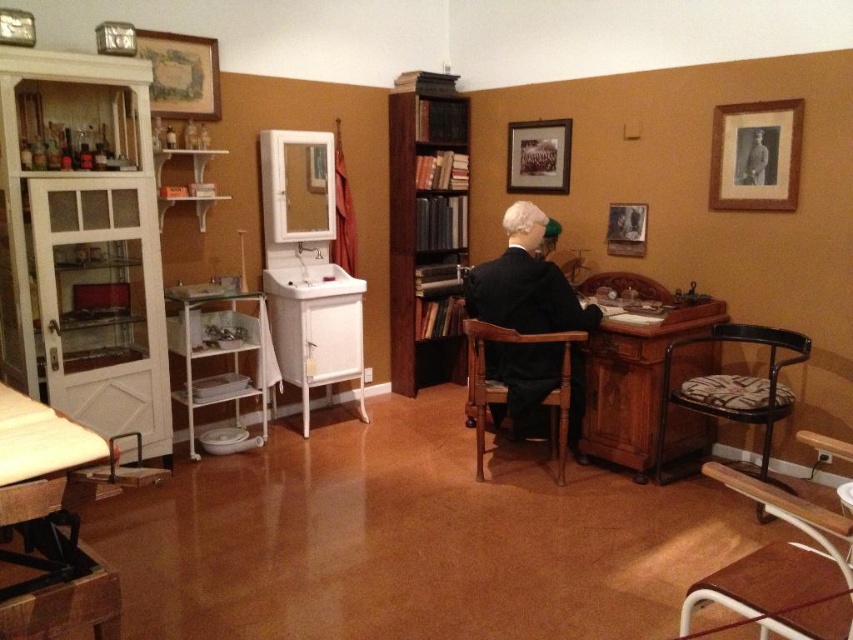
Between mahogany wood desk at center and black suit at center, which one is positioned lower?

mahogany wood desk at center is lower down.

Does mahogany wood desk at center have a lesser height compared to black suit at center?

Incorrect, mahogany wood desk at center's height does not fall short of black suit at center's.

This screenshot has height=640, width=853. Find the location of `mahogany wood desk at center`. mahogany wood desk at center is located at coordinates (633, 371).

Identify the location of mahogany wood desk at center. The image size is (853, 640). (633, 371).

Between brown wooden bookshelf at center and black leather chair at right, which one has less height?

black leather chair at right is shorter.

Is point (399, 253) closer to camera compared to point (659, 442)?

No, it is not.

Does point (424, 365) come farther from viewer compared to point (766, 401)?

Yes, it is.

In order to click on brown wooden bookshelf at center in this screenshot , I will do pos(426,234).

Which is in front, point (703, 410) or point (611, 212)?

Positioned in front is point (703, 410).

Does black leather chair at right appear under black suit at center?

Correct, black leather chair at right is located below black suit at center.

Image resolution: width=853 pixels, height=640 pixels. Describe the element at coordinates (735, 387) in the screenshot. I see `black leather chair at right` at that location.

Find the location of `black leather chair at right`. black leather chair at right is located at coordinates (735, 387).